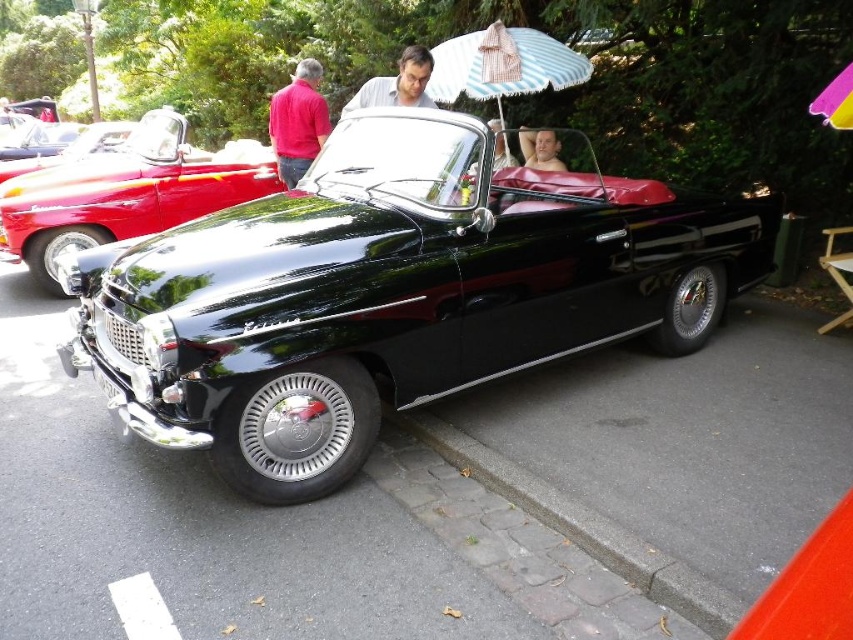
Question: Can you confirm if glossy black convertible at center is positioned to the right of brown cobblestone curb at lower center?

Choices:
 (A) yes
 (B) no

Answer: (A)

Question: Is shiny black convertible at center to the right of brown cobblestone curb at lower center from the viewer's perspective?

Choices:
 (A) yes
 (B) no

Answer: (B)

Question: Which is farther from the striped fabric umbrella at upper center?

Choices:
 (A) pink fabric umbrella at upper right
 (B) shiny black convertible at center
 (C) smooth gray shirt at center
 (D) brown cobblestone curb at lower center

Answer: (D)

Question: Which point is farther from the camera taking this photo?

Choices:
 (A) (846, 108)
 (B) (440, 72)
 (C) (387, 97)

Answer: (B)

Question: Does striped fabric umbrella at upper center come in front of smooth gray shirt at center?

Choices:
 (A) no
 (B) yes

Answer: (A)

Question: Which point appears farthest from the camera in this image?

Choices:
 (A) (317, 113)
 (B) (0, 227)
 (C) (848, 70)
 (D) (692, 612)

Answer: (A)